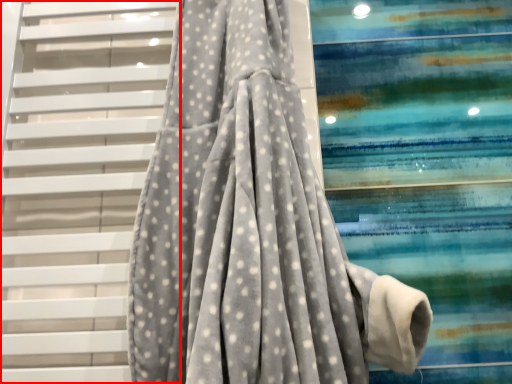
Question: From the image's perspective, what is the correct spatial relationship of stairs (annotated by the red box) in relation to curtain?

Choices:
 (A) below
 (B) above

Answer: (A)